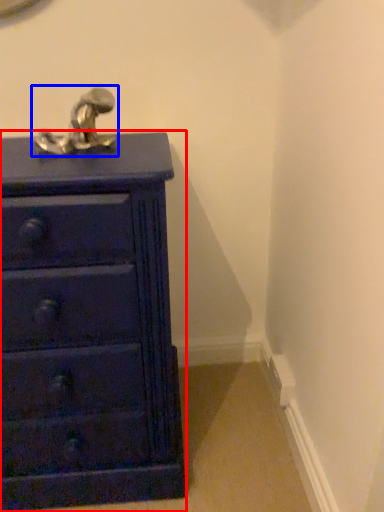
Question: Which object is further to the camera taking this photo, chest of drawers (highlighted by a red box) or tap (highlighted by a blue box)?

Choices:
 (A) chest of drawers
 (B) tap

Answer: (B)